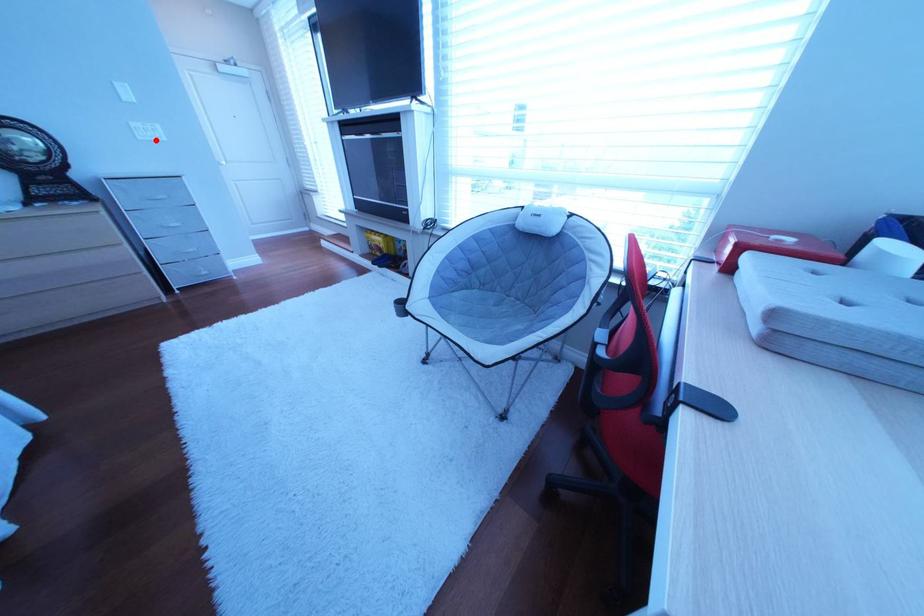
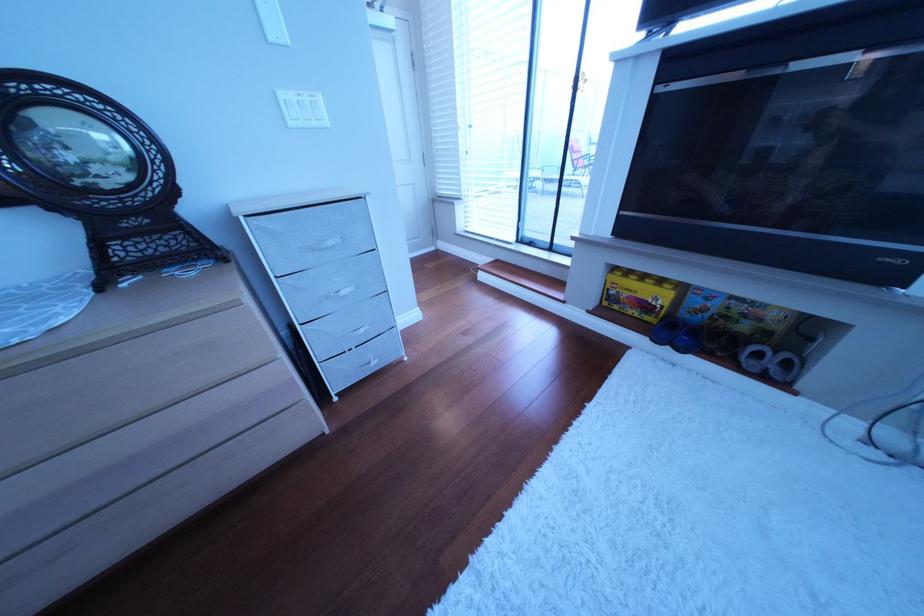
Where in the second image is the point corresponding to the highlighted location from the first image?

(307, 126)